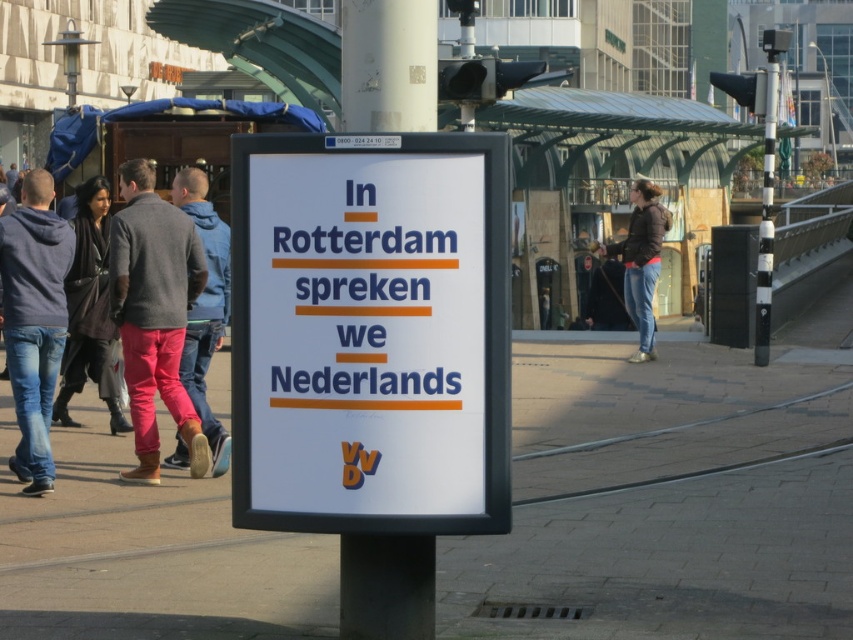
You are a passerby at the tram stop in Rotterdam. You see the matte pink pants at left and the jeans at center. Which clothing item is positioned lower relative to the other?

The matte pink pants at left is located below the jeans at center, so it is positioned lower.